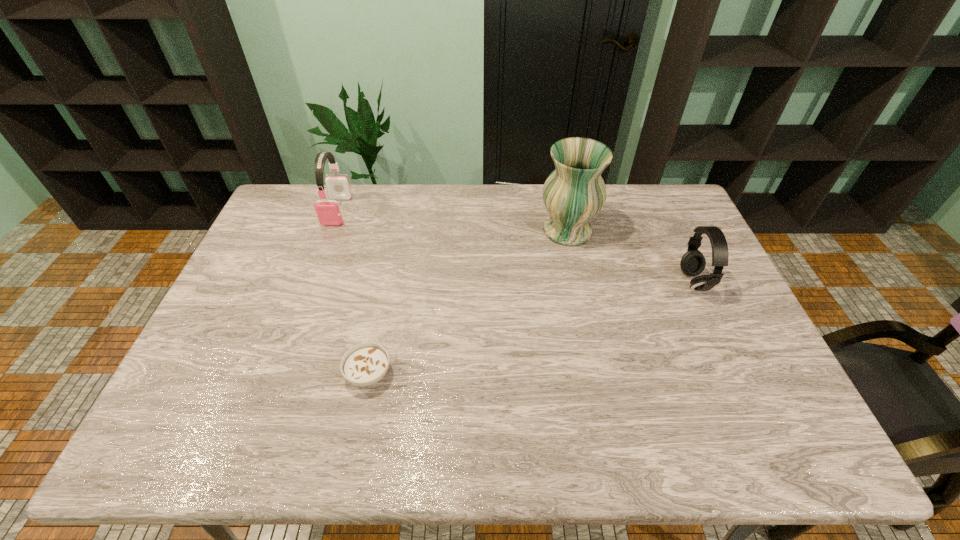
At what (x,y) coordinates should I click in order to perform the action: click on free spot between the nearest object and the vase. Please return your answer as a coordinate pair (x, y). This screenshot has width=960, height=540. Looking at the image, I should click on (468, 302).

Locate an element on the screen. The width and height of the screenshot is (960, 540). free space that is in between the farther earphone and the tallest object is located at coordinates (452, 220).

I want to click on vacant space in between the rightmost object and the farther earphone, so click(516, 246).

Choose which object is the second nearest neighbor to the vase. Please provide its 2D coordinates. Your answer should be formatted as a tuple, i.e. [(x, y)], where the tuple contains the x and y coordinates of a point satisfying the conditions above.

[(365, 364)]

Identify which object is the nearest to the vase. Please provide its 2D coordinates. Your answer should be formatted as a tuple, i.e. [(x, y)], where the tuple contains the x and y coordinates of a point satisfying the conditions above.

[(693, 262)]

Find the location of a particular element. The width and height of the screenshot is (960, 540). vacant area that satisfies the following two spatial constraints: 1. on the outer surface of the vase; 2. on the right side of the farther earphone is located at coordinates (330, 231).

Where is `free space in the image that satisfies the following two spatial constraints: 1. on the outer surface of the farther earphone; 2. on the right side of the soup bowl`? free space in the image that satisfies the following two spatial constraints: 1. on the outer surface of the farther earphone; 2. on the right side of the soup bowl is located at coordinates (277, 374).

This screenshot has height=540, width=960. In order to click on free space in the image that satisfies the following two spatial constraints: 1. on the outer surface of the vase; 2. on the left side of the farther earphone in this screenshot , I will do `click(330, 231)`.